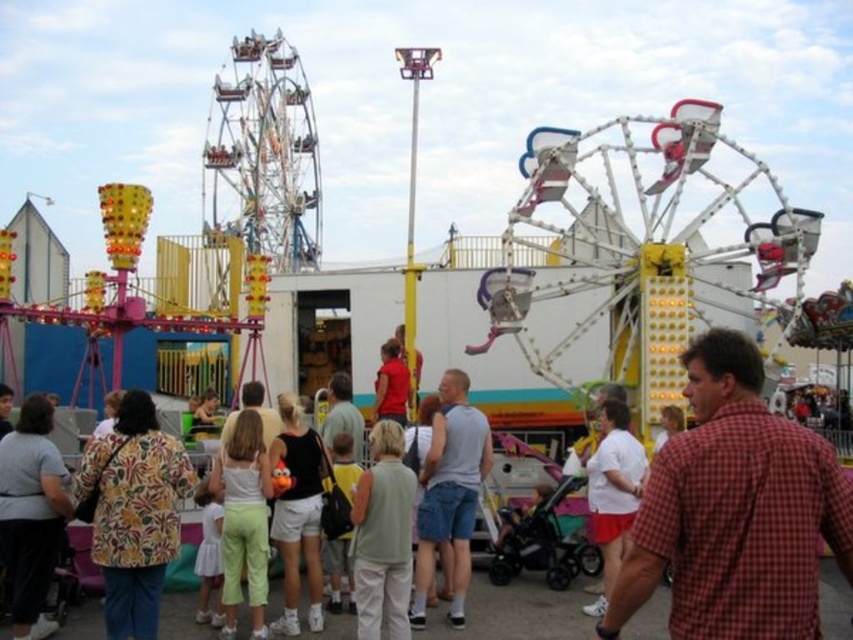
You are a photographer trying to capture both the floral print blouse at lower left and the light green fabric shirt at center in a single shot. Based on their positions and sizes, will you need to adjust your camera angle to include both in the frame?

The floral print blouse at lower left might be wider than light green fabric shirt at center, so you may need to adjust your camera angle to ensure both are fully visible in the frame.

You are a carnival attendee who wants to reach the snack booth located behind the white matte shirt at center. You are currently standing next to the light beige shorts at center. Considering the distance between them, is it feasible for you to walk directly to the snack booth without needing to detour around any obstacles?

The distance between the light beige shorts at center and the white matte shirt at center is 42.77 feet. Since there are no obstacles mentioned in the scene description, you can walk directly to the snack booth without needing to detour.

You are a parent holding a gray cotton tank top at center and want to give your child a ride on the metallic silver carousel at center. Considering the size difference between the two, which item should you prioritize carrying to the carousel first?

The metallic silver carousel at center is larger in size compared to the gray cotton tank top at center, so you should prioritize carrying the metallic silver carousel at center first.